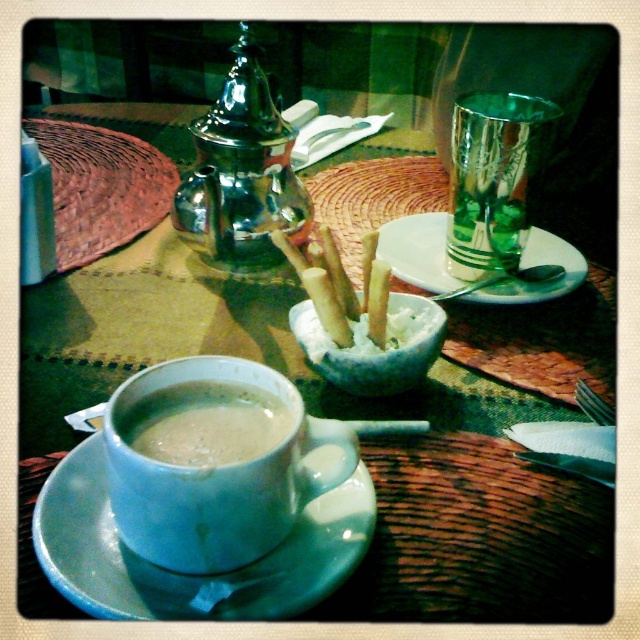
Who is lower down, white glossy mug at center or white creamy sticks at center?

Positioned lower is white glossy mug at center.

Is white glossy mug at center positioned at the back of white creamy sticks at center?

No.

I want to click on white glossy mug at center, so click(x=216, y=467).

Looking at this image, can you confirm if white matte mug at center is smaller than white ceramic saucer at center?

Correct, white matte mug at center occupies less space than white ceramic saucer at center.

Which is above, white matte mug at center or white ceramic saucer at center?

Positioned higher is white ceramic saucer at center.

Consider the image. Who is more forward, [253,440] or [381,248]?

Point [253,440]

Identify the location of white matte mug at center. click(204, 422).

Which is in front, point (275, 400) or point (326, 513)?

Point (275, 400) is in front.

Is white glossy mug at center wider than white ceramic saucer at lower left?

No.

The height and width of the screenshot is (640, 640). Describe the element at coordinates (216, 467) in the screenshot. I see `white glossy mug at center` at that location.

This screenshot has height=640, width=640. In order to click on white glossy mug at center in this screenshot , I will do `click(216, 467)`.